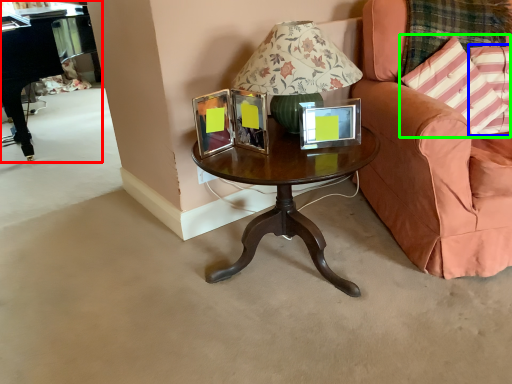
Question: Based on their relative distances, which object is farther from piano (highlighted by a red box)? Choose from pillow (highlighted by a blue box) and pillow (highlighted by a green box).

Choices:
 (A) pillow
 (B) pillow

Answer: (A)